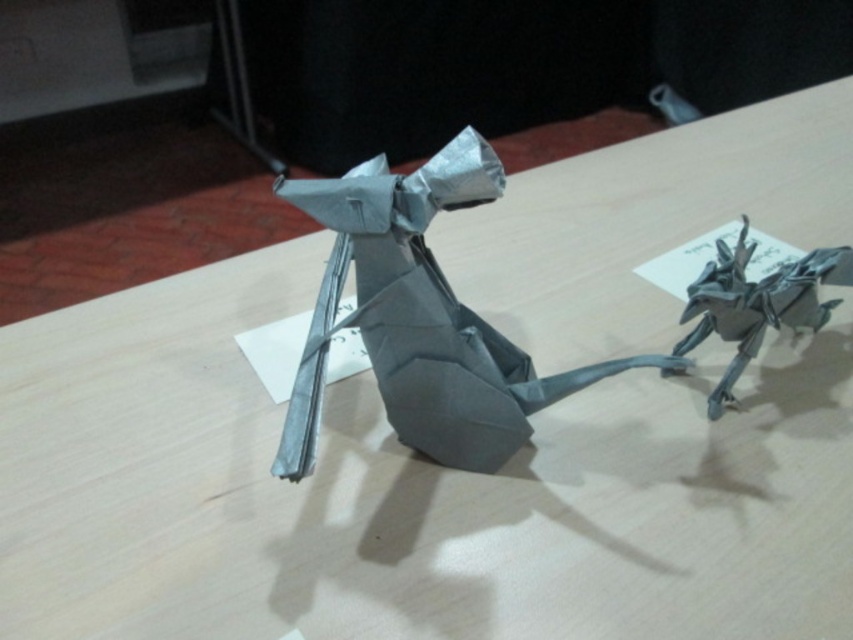
You are standing in front of the wooden surface with the two origami figures. There are two points marked on the image. Which point is closer to you, point (376, 273) or point (727, 269)?

Point (376, 273) is in front of point (727, 269), so it is closer to you.

You have a small box that can hold items up to 10 centimeters in width. You need to store both the gray paper origami mouse at center and the gray paper at center. Can both items fit side by side in the box without overlapping?

The gray paper origami mouse at center might be wider than gray paper at center. Since the exact width difference isn not specified, it is uncertain if both can fit side by side in the 10 centimeter box without overlapping.